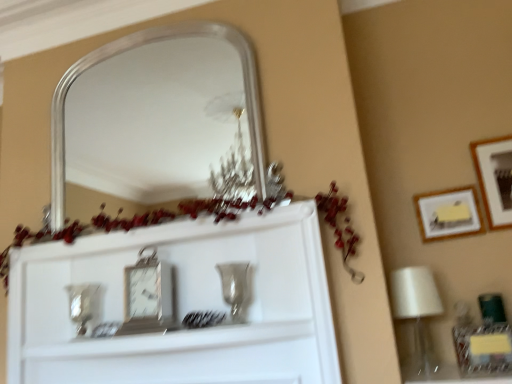
At what (x,y) coordinates should I click in order to perform the action: click on empty space that is ontop of metallic silver clock at center. Please return your answer as a coordinate pair (x, y). Image resolution: width=512 pixels, height=384 pixels. Looking at the image, I should click on tap(135, 243).